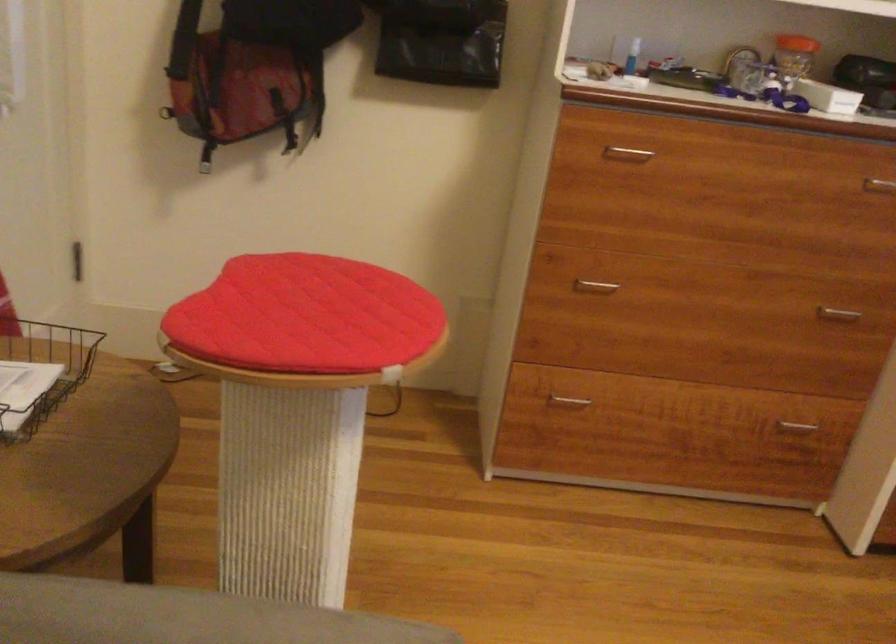
What do you see at coordinates (306, 316) in the screenshot? The width and height of the screenshot is (896, 644). I see `the chair sitting surface` at bounding box center [306, 316].